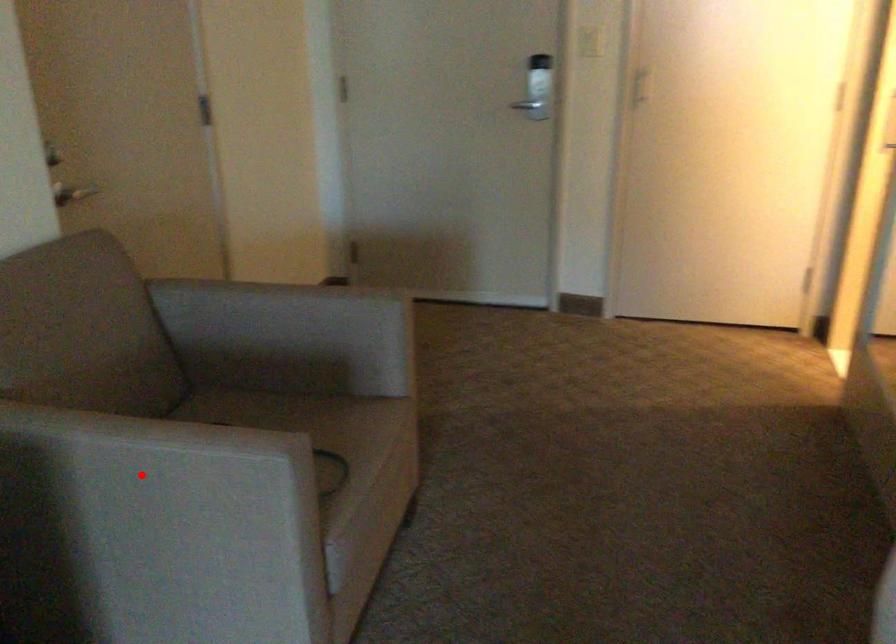
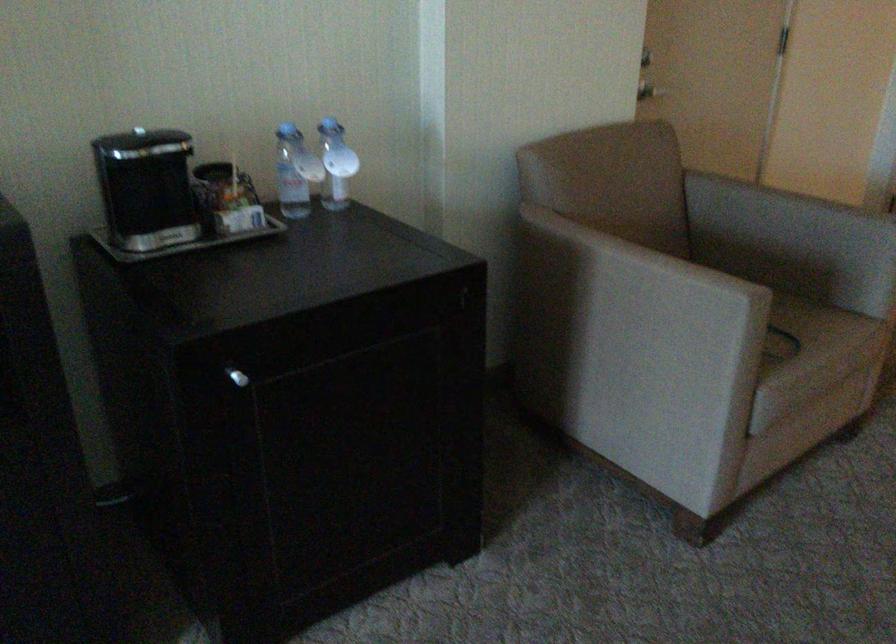
Question: I am providing you with two images of the same scene from different viewpoints. Image1 has a red point marked. In image2, the corresponding 3D location appears at what relative position? Reply with the corresponding letter.

Choices:
 (A) Closer
 (B) Farther

Answer: (B)